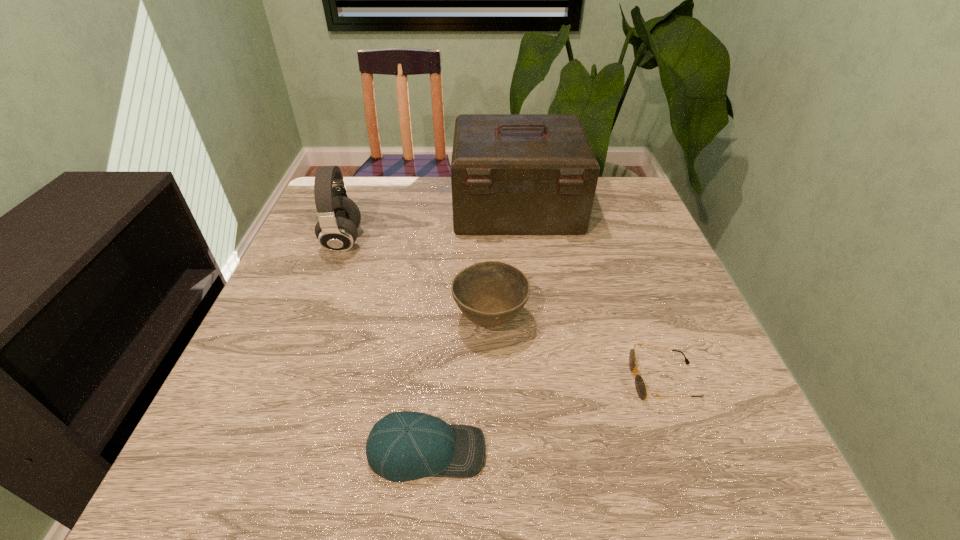
Find the location of `free point between the nearest object and the first-aid kit`. free point between the nearest object and the first-aid kit is located at coordinates (471, 329).

The height and width of the screenshot is (540, 960). I want to click on free area in between the leftmost object and the third nearest object, so click(x=417, y=280).

The width and height of the screenshot is (960, 540). I want to click on free point between the baseball cap and the third shortest object, so click(x=458, y=386).

Locate an element on the screen. The image size is (960, 540). vacant point located between the second tallest object and the third tallest object is located at coordinates (417, 280).

Locate an element on the screen. vacant space that is in between the bowl and the leftmost object is located at coordinates (417, 280).

Find the location of a particular element. The image size is (960, 540). vacant area that lies between the leftmost object and the fourth tallest object is located at coordinates (385, 346).

Where is `blank region between the bowl and the headset`? blank region between the bowl and the headset is located at coordinates (x=417, y=280).

I want to click on the second closest object to the rightmost object, so click(402, 446).

You are a GUI agent. You are given a task and a screenshot of the screen. Output one action in this format:
    pyautogui.click(x=<x>, y=<y>)
    Task: Click on the object that is the fourth closest to the sunglasses
    This screenshot has width=960, height=540.
    Given the screenshot: What is the action you would take?
    pyautogui.click(x=339, y=217)

Find the location of a particular element. This screenshot has height=540, width=960. free space that satisfies the following two spatial constraints: 1. on the ear cups of the headset; 2. on the right side of the bowl is located at coordinates (313, 320).